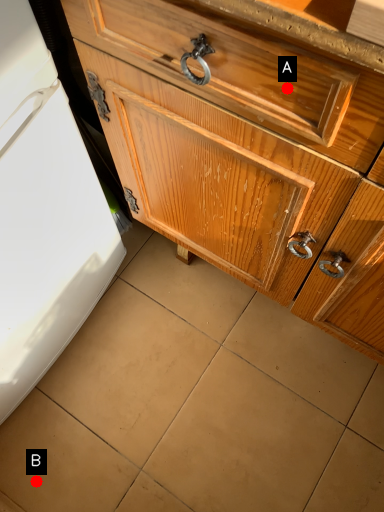
Question: Two points are circled on the image, labeled by A and B beside each circle. Which point is closer to the camera?

Choices:
 (A) A is closer
 (B) B is closer

Answer: (A)